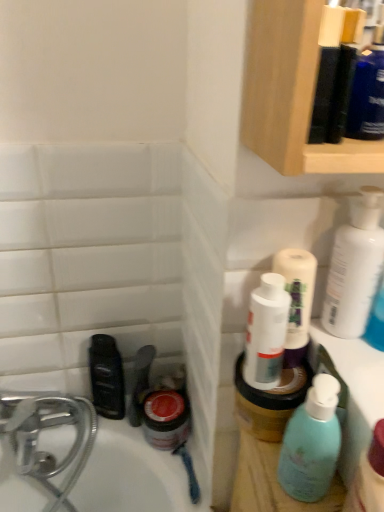
Question: Does teal matte bottle at right lie behind black plastic mouthwash at lower left?

Choices:
 (A) no
 (B) yes

Answer: (A)

Question: Can you confirm if teal matte bottle at right is shorter than black plastic mouthwash at lower left?

Choices:
 (A) yes
 (B) no

Answer: (B)

Question: Is black plastic mouthwash at lower left completely or partially inside teal matte bottle at right?

Choices:
 (A) no
 (B) yes

Answer: (A)

Question: Is teal matte bottle at right to the right of black plastic mouthwash at lower left from the viewer's perspective?

Choices:
 (A) yes
 (B) no

Answer: (A)

Question: Can you confirm if teal matte bottle at right is taller than black plastic mouthwash at lower left?

Choices:
 (A) no
 (B) yes

Answer: (B)

Question: From the image's perspective, relative to black plastic mouthwash at lower left, is teal matte bottle at right above or below?

Choices:
 (A) above
 (B) below

Answer: (A)

Question: From a real-world perspective, relative to black plastic mouthwash at lower left, is teal matte bottle at right vertically above or below?

Choices:
 (A) below
 (B) above

Answer: (B)

Question: In the image, is teal matte bottle at right on the left side or the right side of black plastic mouthwash at lower left?

Choices:
 (A) left
 (B) right

Answer: (B)

Question: Do you think teal matte bottle at right is within black plastic mouthwash at lower left, or outside of it?

Choices:
 (A) inside
 (B) outside

Answer: (B)

Question: In the image, is black plastic mouthwash at lower left positioned in front of or behind white glossy lotion at upper right?

Choices:
 (A) front
 (B) behind

Answer: (B)

Question: Based on their sizes in the image, would you say black plastic mouthwash at lower left is bigger or smaller than white glossy lotion at upper right?

Choices:
 (A) big
 (B) small

Answer: (B)

Question: Considering the positions of point (102, 362) and point (337, 307), is point (102, 362) closer or farther from the camera than point (337, 307)?

Choices:
 (A) closer
 (B) farther

Answer: (B)

Question: From a real-world perspective, is black plastic mouthwash at lower left positioned above or below white glossy lotion at upper right?

Choices:
 (A) above
 (B) below

Answer: (B)

Question: Is teal matte bottle at right bigger or smaller than white glossy lotion at upper right?

Choices:
 (A) small
 (B) big

Answer: (A)

Question: Is point (304, 422) closer or farther from the camera than point (344, 225)?

Choices:
 (A) closer
 (B) farther

Answer: (A)